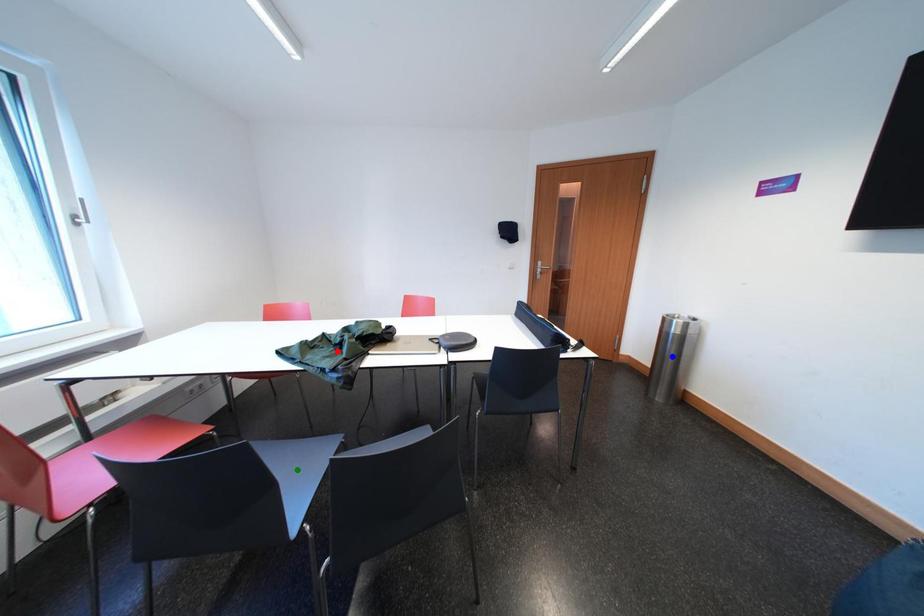
Order these from farthest to nearest:
A) blue point
B) red point
C) green point

blue point, red point, green point